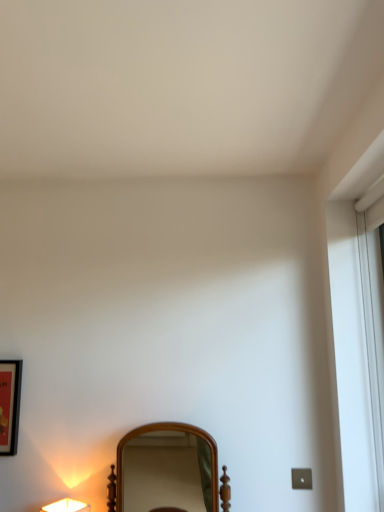
Question: From a real-world perspective, is matte white lamp at lower left positioned over wooden mirror at center based on gravity?

Choices:
 (A) no
 (B) yes

Answer: (A)

Question: Is matte white lamp at lower left located outside wooden mirror at center?

Choices:
 (A) yes
 (B) no

Answer: (A)

Question: Is matte white lamp at lower left positioned with its back to wooden mirror at center?

Choices:
 (A) no
 (B) yes

Answer: (A)

Question: Does matte white lamp at lower left have a lesser width compared to wooden mirror at center?

Choices:
 (A) no
 (B) yes

Answer: (B)

Question: Is wooden mirror at center a part of matte white lamp at lower left?

Choices:
 (A) yes
 (B) no

Answer: (B)

Question: Is matte white lamp at lower left wider than wooden mirror at center?

Choices:
 (A) no
 (B) yes

Answer: (A)

Question: Considering the relative positions of wooden mirror at center and matte white lamp at lower left in the image provided, is wooden mirror at center to the right of matte white lamp at lower left from the viewer's perspective?

Choices:
 (A) yes
 (B) no

Answer: (A)

Question: Is wooden mirror at center smaller than matte white lamp at lower left?

Choices:
 (A) no
 (B) yes

Answer: (A)

Question: Is wooden mirror at center not close to matte white lamp at lower left?

Choices:
 (A) yes
 (B) no

Answer: (A)

Question: Is matte white lamp at lower left completely or partially inside wooden mirror at center?

Choices:
 (A) no
 (B) yes

Answer: (A)

Question: Is wooden mirror at center not inside matte white lamp at lower left?

Choices:
 (A) no
 (B) yes

Answer: (B)

Question: Is wooden mirror at center further to camera compared to matte white lamp at lower left?

Choices:
 (A) yes
 (B) no

Answer: (B)

Question: Does matte white lamp at lower left lie behind matte black picture frame at left?

Choices:
 (A) yes
 (B) no

Answer: (B)